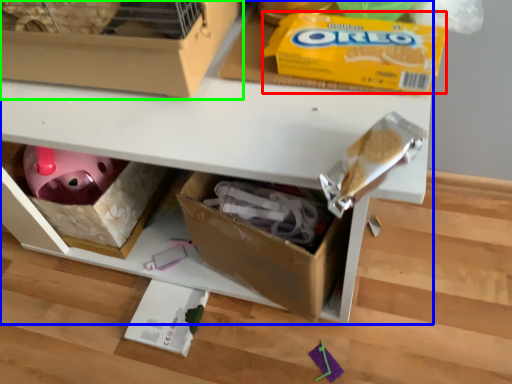
Question: Estimate the real-world distances between objects in this image. Which object is farther from cereal (highlighted by a red box), shelf (highlighted by a blue box) or box (highlighted by a green box)?

Choices:
 (A) shelf
 (B) box

Answer: (A)